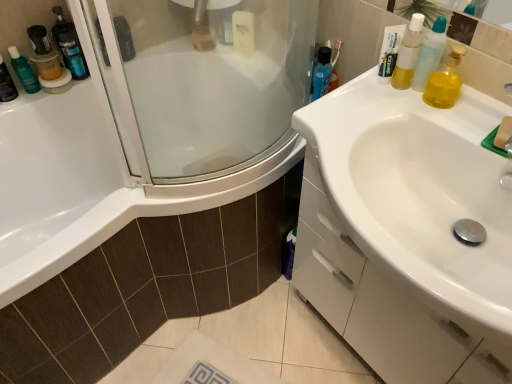
Question: Choose the correct answer: Is translucent plastic container at upper left, which appears as the second toiletry when viewed from the right, inside translucent plastic mouthwash at left, marked as the first mouthwash in a left-to-right arrangement, or outside it?

Choices:
 (A) inside
 (B) outside

Answer: (B)

Question: Is translucent plastic container at upper left, which is counted as the 1th toiletry, starting from the left, wider or thinner than translucent plastic mouthwash at left, the 2th mouthwash viewed from the back?

Choices:
 (A) thin
 (B) wide

Answer: (A)

Question: Which object is the farthest from the translucent plastic mouthwash at left, the 2th mouthwash viewed from the back?

Choices:
 (A) translucent plastic mouthwash at upper right, which is the first mouthwash in right-to-left order
 (B) blue glossy mouthwash at upper right, positioned as the third mouthwash in left-to-right order
 (C) yellow translucent liquid at upper right, the second toiletry viewed from the back
 (D) white glossy sink at right
 (E) translucent plastic bottle at upper left

Answer: (D)

Question: Estimate the real-world distances between objects in this image. Which object is closer to the yellow translucent liquid at upper right, the second toiletry viewed from the back?

Choices:
 (A) translucent plastic mouthwash at upper right, which appears as the 4th mouthwash when viewed from the back
 (B) translucent plastic container at upper left, which appears as the second toiletry when viewed from the right
 (C) translucent plastic bottle at upper left
 (D) white glossy sink at right
 (E) blue glossy mouthwash at upper right, arranged as the 3th mouthwash when viewed from the back

Answer: (A)